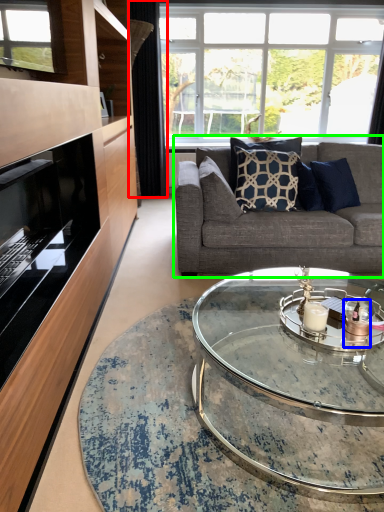
Question: Based on their relative distances, which object is farther from curtain (highlighted by a red box)? Choose from candle holder (highlighted by a blue box) and studio couch (highlighted by a green box).

Choices:
 (A) candle holder
 (B) studio couch

Answer: (A)